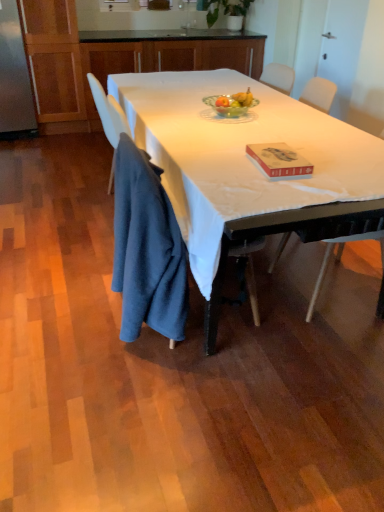
Question: Can you confirm if white matte table at center is smaller than green leafy plant at upper center?

Choices:
 (A) no
 (B) yes

Answer: (A)

Question: Is white matte table at center in front of green leafy plant at upper center?

Choices:
 (A) no
 (B) yes

Answer: (B)

Question: Is the position of white matte table at center more distant than that of green leafy plant at upper center?

Choices:
 (A) yes
 (B) no

Answer: (B)

Question: Considering the relative sizes of white matte table at center and green leafy plant at upper center in the image provided, is white matte table at center shorter than green leafy plant at upper center?

Choices:
 (A) yes
 (B) no

Answer: (B)

Question: From a real-world perspective, does white matte table at center stand above green leafy plant at upper center?

Choices:
 (A) no
 (B) yes

Answer: (A)

Question: Is white matte table at center looking in the opposite direction of green leafy plant at upper center?

Choices:
 (A) no
 (B) yes

Answer: (A)

Question: From a real-world perspective, is wooden cabinet at upper center, which appears as the 2th cabinetry when viewed from the top, below white glossy sink at upper center?

Choices:
 (A) no
 (B) yes

Answer: (B)

Question: Is wooden cabinet at upper center, which appears as the 2th cabinetry when viewed from the top, turned away from white glossy sink at upper center?

Choices:
 (A) yes
 (B) no

Answer: (A)

Question: Is wooden cabinet at upper center, positioned as the 1th cabinetry in bottom-to-top order, surrounding white glossy sink at upper center?

Choices:
 (A) no
 (B) yes

Answer: (B)

Question: Are wooden cabinet at upper center, positioned as the 1th cabinetry in bottom-to-top order, and white glossy sink at upper center making contact?

Choices:
 (A) yes
 (B) no

Answer: (B)

Question: Are wooden cabinet at upper center, which appears as the 2th cabinetry when viewed from the top, and white glossy sink at upper center located far from each other?

Choices:
 (A) yes
 (B) no

Answer: (B)

Question: Is wooden cabinet at upper center, which appears as the 2th cabinetry when viewed from the top, wider than white glossy sink at upper center?

Choices:
 (A) yes
 (B) no

Answer: (A)

Question: Is wooden cabinet at upper center, which appears as the 2th cabinetry when viewed from the top, at the left side of white matte table at center?

Choices:
 (A) yes
 (B) no

Answer: (A)